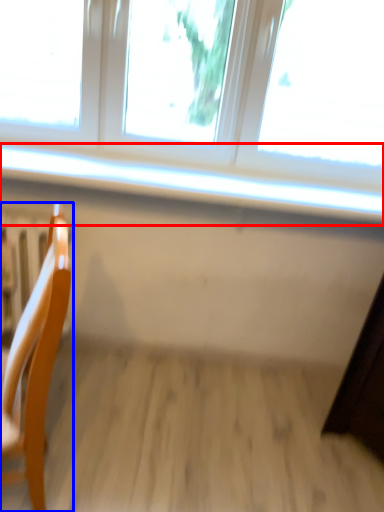
Question: Which point is further to the camera, window sill (highlighted by a red box) or chair (highlighted by a blue box)?

Choices:
 (A) window sill
 (B) chair

Answer: (A)